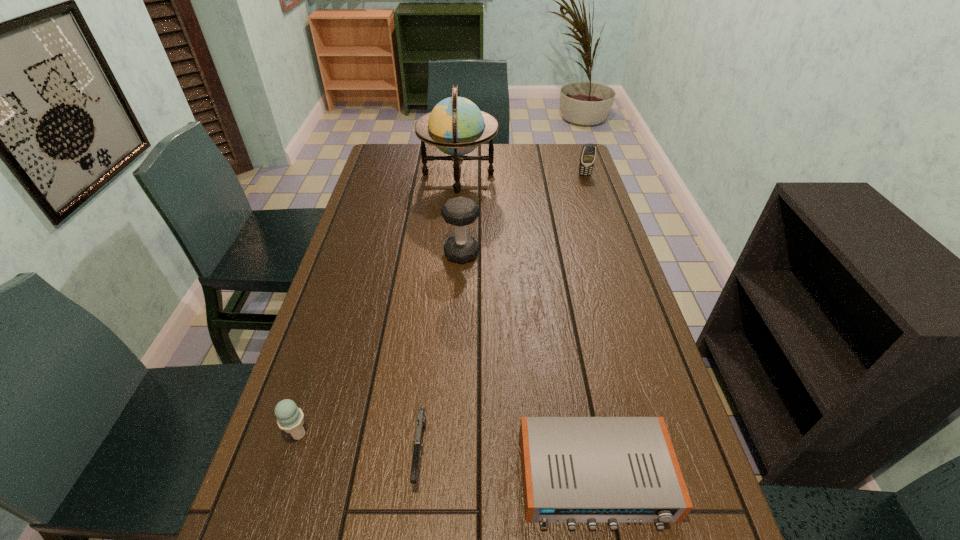
Where is `vacant space that's between the second object from right to left and the cellular telephone`? Image resolution: width=960 pixels, height=540 pixels. vacant space that's between the second object from right to left and the cellular telephone is located at coordinates (589, 327).

Find the location of `vacant region between the tallest object and the ice cream`. vacant region between the tallest object and the ice cream is located at coordinates (378, 304).

Where is `vacant area between the cellular telephone and the gun`? vacant area between the cellular telephone and the gun is located at coordinates (503, 314).

You are a GUI agent. You are given a task and a screenshot of the screen. Output one action in this format:
    pyautogui.click(x=<x>, y=<y>)
    Task: Click on the free spot between the rightmost object and the ice cream
    
    Given the screenshot: What is the action you would take?
    pyautogui.click(x=442, y=305)

Locate an element on the screen. Image resolution: width=960 pixels, height=540 pixels. free point between the ice cream and the dumbbell is located at coordinates (380, 344).

The image size is (960, 540). Identify the location of unoccupied area between the tallest object and the gun. (440, 313).

Find the location of a particular element. The height and width of the screenshot is (540, 960). vacant area between the ice cream and the second object from right to left is located at coordinates (447, 456).

At what (x,y) coordinates should I click in order to perform the action: click on unoccupied area between the cellular telephone and the dumbbell. Please return your answer as a coordinate pair (x, y). Image resolution: width=960 pixels, height=540 pixels. Looking at the image, I should click on (523, 214).

Where is `the fourth closest object relative to the dumbbell`? the fourth closest object relative to the dumbbell is located at coordinates (587, 158).

The height and width of the screenshot is (540, 960). In order to click on object that is the fifth nearest to the fifth object from left to right in this screenshot , I will do `click(587, 158)`.